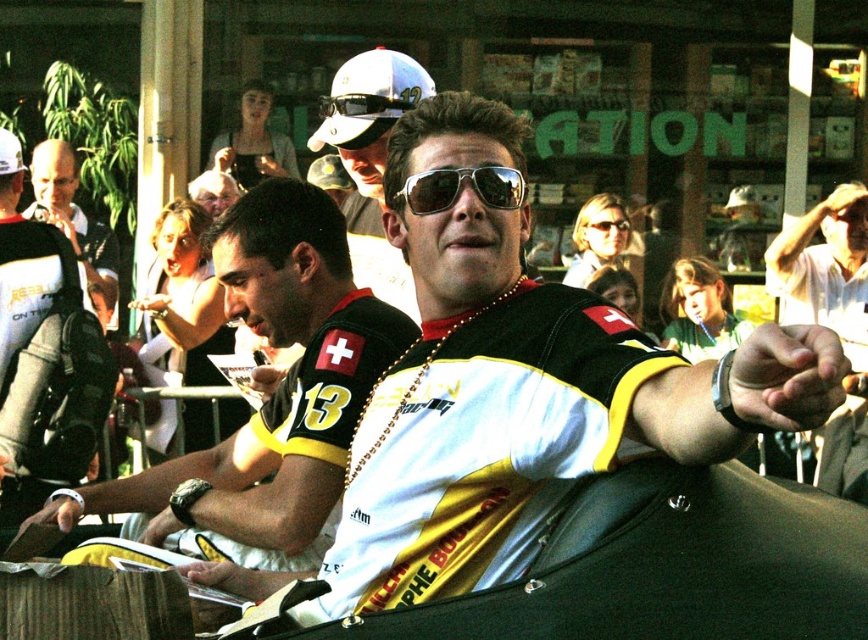
You are a photographer trying to capture the man at center. You notice a point at coordinates (459, 188). Where exactly is this point located on the man?

The point at coordinates (459, 188) is located on the sunglasses at center.